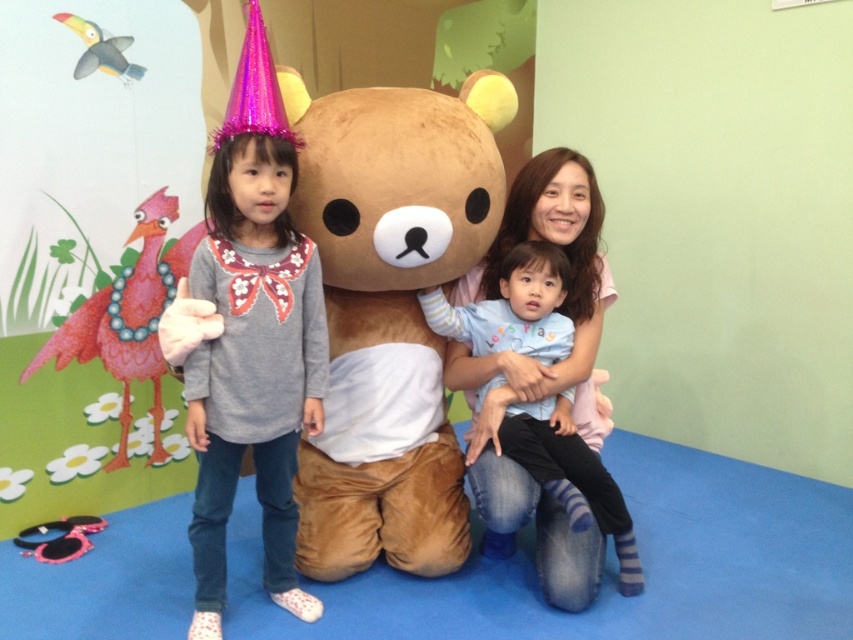
Question: Estimate the real-world distances between objects in this image. Which object is closer to the light blue cotton shirt at center?

Choices:
 (A) brown plush bear at center
 (B) matte gray sweater at center

Answer: (A)

Question: Is matte gray sweater at center thinner than light blue cotton shirt at center?

Choices:
 (A) no
 (B) yes

Answer: (B)

Question: Which point appears closest to the camera in this image?

Choices:
 (A) (196, 540)
 (B) (328, 147)

Answer: (A)

Question: Which of the following is the closest to the observer?

Choices:
 (A) (329, 364)
 (B) (238, 420)

Answer: (B)

Question: Can you confirm if brown plush bear at center is positioned below matte gray sweater at center?

Choices:
 (A) no
 (B) yes

Answer: (A)

Question: Does brown plush bear at center appear on the left side of light blue cotton shirt at center?

Choices:
 (A) no
 (B) yes

Answer: (B)